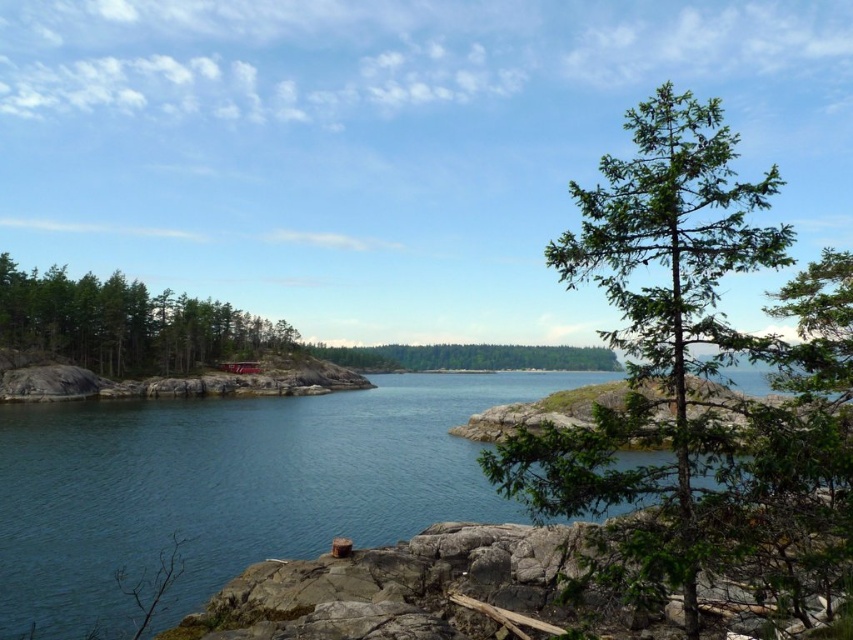
Between point (758, 349) and point (340, 360), which one is positioned in front?

Positioned in front is point (758, 349).

How far apart are green leafy tree at center and green matte tree at center?

green leafy tree at center and green matte tree at center are 146.62 meters apart from each other.

You are a GUI agent. You are given a task and a screenshot of the screen. Output one action in this format:
    pyautogui.click(x=<x>, y=<y>)
    Task: Click on the green leafy tree at center
    
    Given the screenshot: What is the action you would take?
    pyautogui.click(x=654, y=332)

Between blue water at center and green matte tree at left, which one has less height?

With less height is blue water at center.

Can you confirm if blue water at center is positioned to the right of green matte tree at left?

Indeed, blue water at center is positioned on the right side of green matte tree at left.

Is point (22, 611) behind point (177, 296)?

That is False.

The image size is (853, 640). Find the location of `blue water at center`. blue water at center is located at coordinates (228, 483).

Describe the element at coordinates (126, 323) in the screenshot. I see `green matte tree at left` at that location.

Who is more forward, (161,337) or (352,358)?

Point (161,337) is more forward.

Image resolution: width=853 pixels, height=640 pixels. In order to click on green matte tree at left in this screenshot , I will do `click(126, 323)`.

Locate an element on the screen. The image size is (853, 640). green matte tree at left is located at coordinates (126, 323).